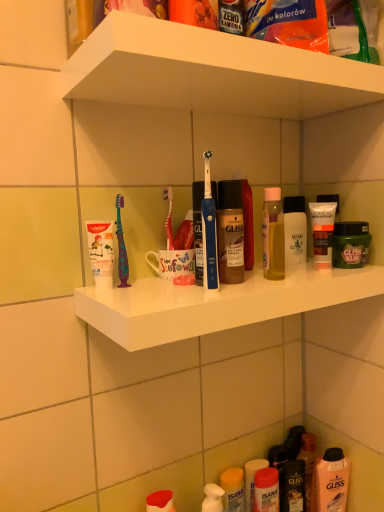
Question: Is blue plastic toothbrush at center not within green matte hair mask at right, which is the third toiletry from bottom to top?

Choices:
 (A) no
 (B) yes

Answer: (B)

Question: Is blue plastic toothbrush at center bigger than green matte hair mask at right, the 2th toiletry positioned from the top?

Choices:
 (A) no
 (B) yes

Answer: (A)

Question: From the image's perspective, is blue plastic toothbrush at center over green matte hair mask at right, marked as the first toiletry in a right-to-left arrangement?

Choices:
 (A) no
 (B) yes

Answer: (B)

Question: Can you confirm if blue plastic toothbrush at center is smaller than green matte hair mask at right, the 2th toiletry positioned from the top?

Choices:
 (A) no
 (B) yes

Answer: (B)

Question: Considering the relative sizes of blue plastic toothbrush at center and green matte hair mask at right, marked as the first toiletry in a right-to-left arrangement, in the image provided, is blue plastic toothbrush at center wider than green matte hair mask at right, marked as the first toiletry in a right-to-left arrangement,?

Choices:
 (A) no
 (B) yes

Answer: (A)

Question: Based on their positions, is blue plastic toothbrush at center located to the left or right of white matte tube at right, which appears as the 1th toiletry when viewed from the top?

Choices:
 (A) left
 (B) right

Answer: (A)

Question: In the image, is blue plastic toothbrush at center positioned in front of or behind white matte tube at right, which ranks as the 2th toiletry in right-to-left order?

Choices:
 (A) front
 (B) behind

Answer: (A)

Question: Is blue plastic toothbrush at center inside the boundaries of white matte tube at right, which appears as the 1th toiletry when viewed from the top, or outside?

Choices:
 (A) outside
 (B) inside

Answer: (A)

Question: Considering the positions of point (210, 202) and point (331, 248), is point (210, 202) closer or farther from the camera than point (331, 248)?

Choices:
 (A) closer
 (B) farther

Answer: (A)

Question: Is blue plastic toothbrush at center taller or shorter than white plastic shelf at upper center, acting as the 2th supermarket shelf starting from the bottom?

Choices:
 (A) short
 (B) tall

Answer: (B)

Question: Would you say blue plastic toothbrush at center is inside or outside white plastic shelf at upper center, which is the first supermarket shelf from top to bottom?

Choices:
 (A) inside
 (B) outside

Answer: (B)

Question: In terms of size, does blue plastic toothbrush at center appear bigger or smaller than white plastic shelf at upper center, which is the first supermarket shelf from top to bottom?

Choices:
 (A) big
 (B) small

Answer: (B)

Question: Does point (215, 210) appear closer or farther from the camera than point (210, 97)?

Choices:
 (A) closer
 (B) farther

Answer: (A)

Question: Is green matte hair mask at right, which is the third toiletry from bottom to top, wider or thinner than matte yellow lotion at lower center, the fourth toiletry when ordered from top to bottom?

Choices:
 (A) thin
 (B) wide

Answer: (B)

Question: Is green matte hair mask at right, the 2th toiletry positioned from the top, in front of or behind matte yellow lotion at lower center, the fourth toiletry when ordered from top to bottom, in the image?

Choices:
 (A) front
 (B) behind

Answer: (A)